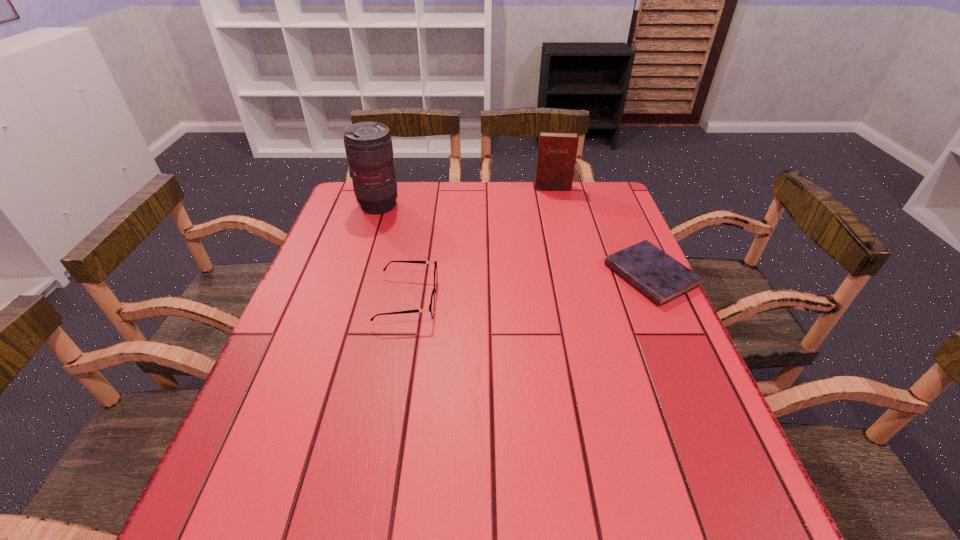
This screenshot has width=960, height=540. What are the coordinates of `vacant region that satisfies the following two spatial constraints: 1. on the front side of the farther diary; 2. on the right side of the shortest object` in the screenshot? It's located at (575, 276).

You are a GUI agent. You are given a task and a screenshot of the screen. Output one action in this format:
    pyautogui.click(x=<x>, y=<y>)
    Task: Click on the vacant space that satisfies the following two spatial constraints: 1. on the back side of the tallest object; 2. on the right side of the farther diary
    
    Given the screenshot: What is the action you would take?
    pyautogui.click(x=384, y=187)

This screenshot has height=540, width=960. What are the coordinates of `vacant area in the image that satisfies the following two spatial constraints: 1. on the front side of the nearer diary; 2. on the right side of the farther diary` in the screenshot? It's located at pyautogui.click(x=575, y=276).

Where is `free space that satisfies the following two spatial constraints: 1. on the front side of the telephoto lens; 2. on the front-facing side of the third object from right to left`? The width and height of the screenshot is (960, 540). free space that satisfies the following two spatial constraints: 1. on the front side of the telephoto lens; 2. on the front-facing side of the third object from right to left is located at coordinates (348, 300).

Locate an element on the screen. This screenshot has width=960, height=540. vacant region that satisfies the following two spatial constraints: 1. on the front side of the third tallest object; 2. on the front-facing side of the leftmost object is located at coordinates (348, 300).